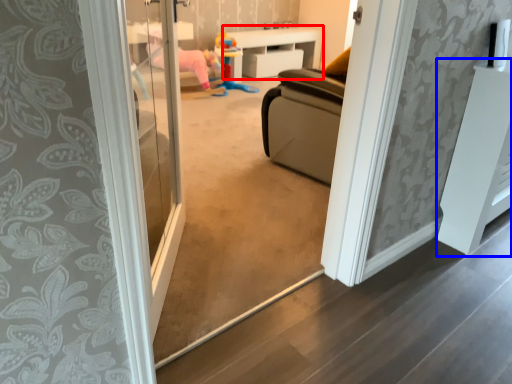
Question: Which of the following is the closest to the observer, furniture (highlighted by a red box) or furniture (highlighted by a blue box)?

Choices:
 (A) furniture
 (B) furniture

Answer: (B)